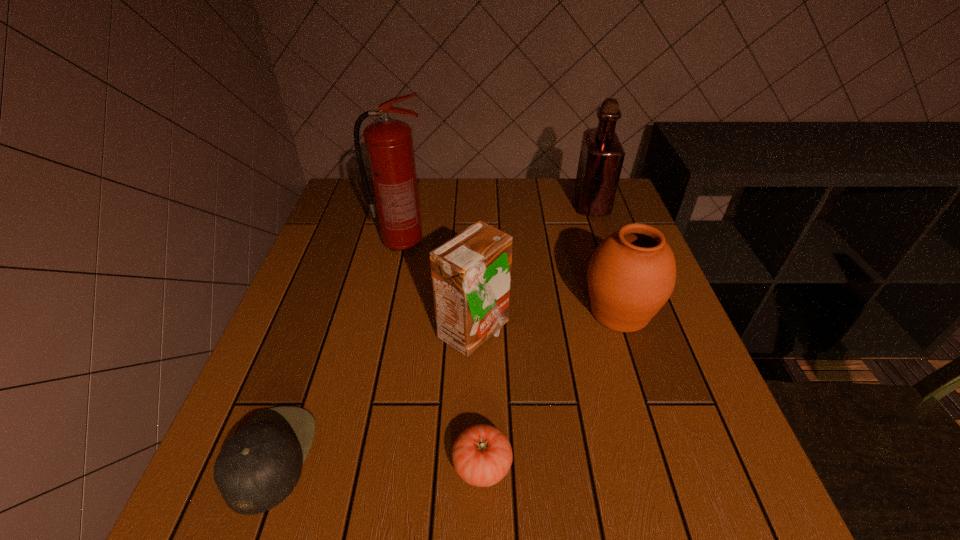
The width and height of the screenshot is (960, 540). I want to click on free space that satisfies the following two spatial constraints: 1. on the front side of the farthest object; 2. on the handle side the fire extinguisher, so click(x=605, y=244).